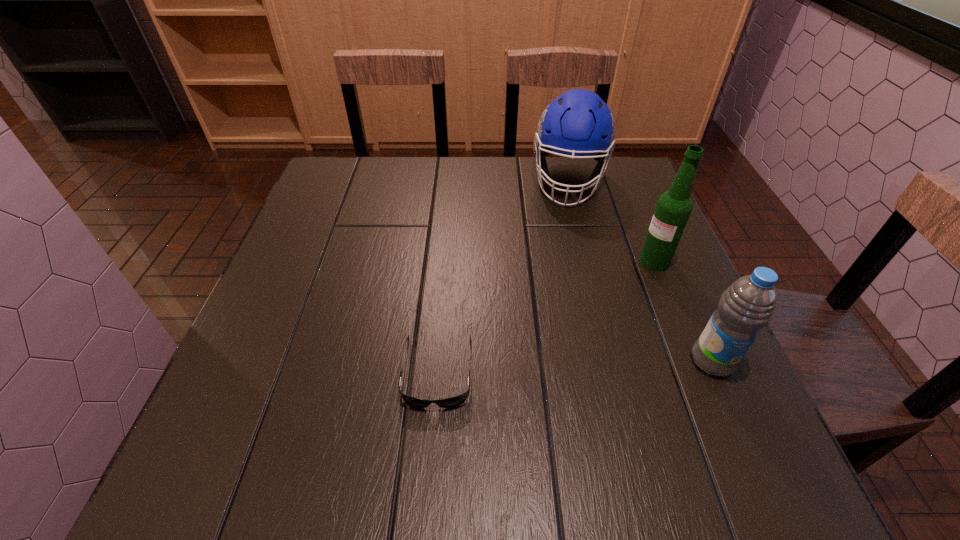
In order to click on the leftmost object in this screenshot , I will do `click(458, 400)`.

What are the coordinates of `sunglasses` in the screenshot? It's located at (458, 400).

At what (x,y) coordinates should I click in order to perform the action: click on water bottle. Please return your answer as a coordinate pair (x, y). The image size is (960, 540). Looking at the image, I should click on (748, 305).

The height and width of the screenshot is (540, 960). Identify the location of beer bottle. (673, 208).

At what (x,y) coordinates should I click in order to perform the action: click on the farthest object. Please return your answer as a coordinate pair (x, y). Image resolution: width=960 pixels, height=540 pixels. Looking at the image, I should click on (579, 123).

This screenshot has width=960, height=540. What are the coordinates of `football helmet` in the screenshot? It's located at (579, 123).

The width and height of the screenshot is (960, 540). I want to click on free region located on the left of the water bottle, so click(532, 361).

This screenshot has height=540, width=960. I want to click on vacant space situated on the label of the third nearest object, so click(602, 309).

Locate an element on the screen. This screenshot has width=960, height=540. vacant position located on the label of the third nearest object is located at coordinates (602, 309).

Locate an element on the screen. Image resolution: width=960 pixels, height=540 pixels. vacant space positioned on the label of the third nearest object is located at coordinates tap(568, 340).